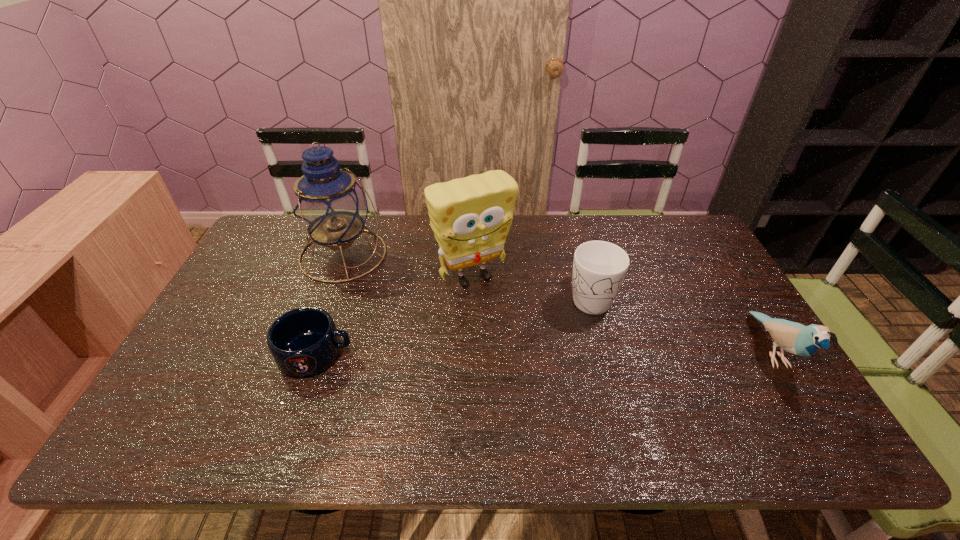
Locate an element on the screen. Image resolution: width=960 pixels, height=540 pixels. vacant area that lies between the left mug and the right mug is located at coordinates (453, 325).

Find the location of a particular element. Image resolution: width=960 pixels, height=540 pixels. vacant area that lies between the sponge and the nearer mug is located at coordinates (395, 315).

The image size is (960, 540). What are the coordinates of `vacant area that lies between the third object from left to right and the taller mug` in the screenshot? It's located at (532, 286).

Where is `vacant space in between the shorter mug and the right mug`? The height and width of the screenshot is (540, 960). vacant space in between the shorter mug and the right mug is located at coordinates (453, 325).

Locate an element on the screen. vacant region between the left mug and the rightmost object is located at coordinates (544, 352).

This screenshot has width=960, height=540. In order to click on free space between the lantern and the third object from right to left in this screenshot , I will do `click(408, 266)`.

The height and width of the screenshot is (540, 960). Identify the location of vacant area that lies between the farther mug and the bird. (681, 323).

At what (x,y) coordinates should I click in order to perform the action: click on vacant space that is in between the second object from right to left and the rightmost object. Please return your answer as a coordinate pair (x, y). Image resolution: width=960 pixels, height=540 pixels. Looking at the image, I should click on (681, 323).

Locate an element on the screen. object that stands as the third closest to the third object from left to right is located at coordinates (305, 341).

Locate which object is the closest to the right mug. Please provide its 2D coordinates. Your answer should be formatted as a tuple, i.e. [(x, y)], where the tuple contains the x and y coordinates of a point satisfying the conditions above.

[(471, 217)]